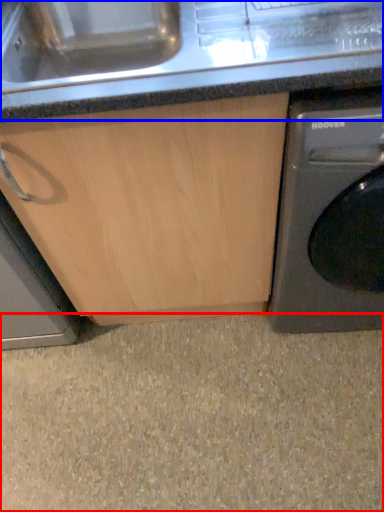
Question: Which point is further to the camera, granite (highlighted by a red box) or counter top (highlighted by a blue box)?

Choices:
 (A) granite
 (B) counter top

Answer: (A)